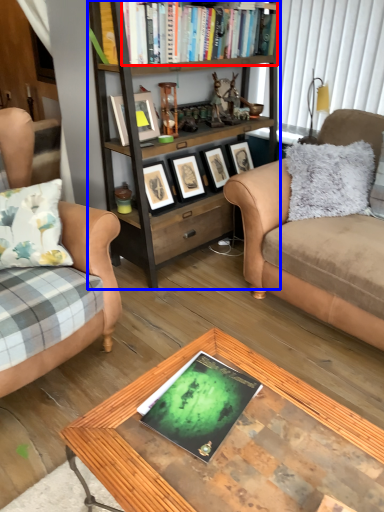
Question: Which object appears farthest to the camera in this image, book (highlighted by a red box) or bookcase (highlighted by a blue box)?

Choices:
 (A) book
 (B) bookcase

Answer: (A)